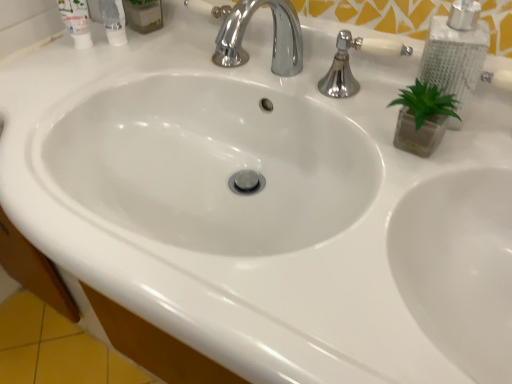
I want to click on vacant space to the right of white glossy tube at upper left, which appears as the 2th mouthwash when viewed from the right, so click(x=170, y=64).